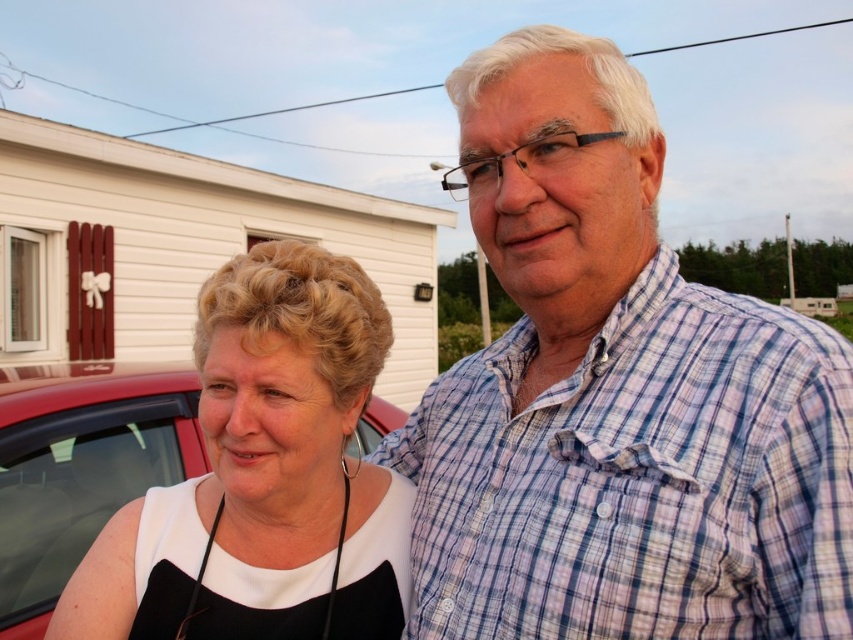
Who is more forward, [498,118] or [357,371]?

Positioned in front is point [498,118].

Is plaid shirt at right thinner than white matte dress at center?

In fact, plaid shirt at right might be wider than white matte dress at center.

Describe the element at coordinates (616, 396) in the screenshot. I see `plaid shirt at right` at that location.

Image resolution: width=853 pixels, height=640 pixels. What are the coordinates of `plaid shirt at right` in the screenshot? It's located at (616, 396).